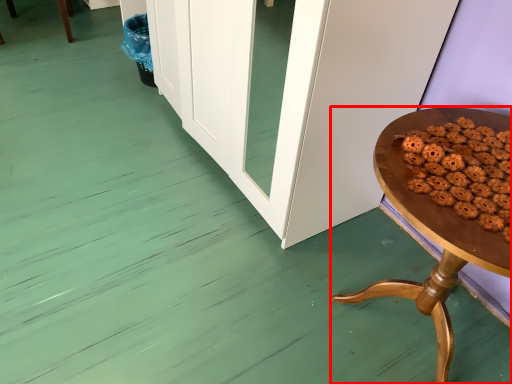
Question: From the image's perspective, considering the relative positions of table (annotated by the red box) and food in the image provided, where is table (annotated by the red box) located with respect to the staircase?

Choices:
 (A) above
 (B) below

Answer: (B)